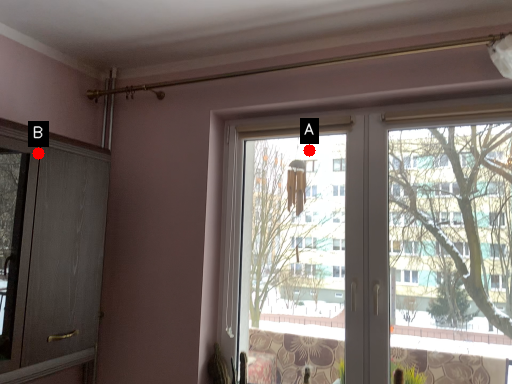
Question: Two points are circled on the image, labeled by A and B beside each circle. Among these points, which one is nearest to the camera?

Choices:
 (A) A is closer
 (B) B is closer

Answer: (B)